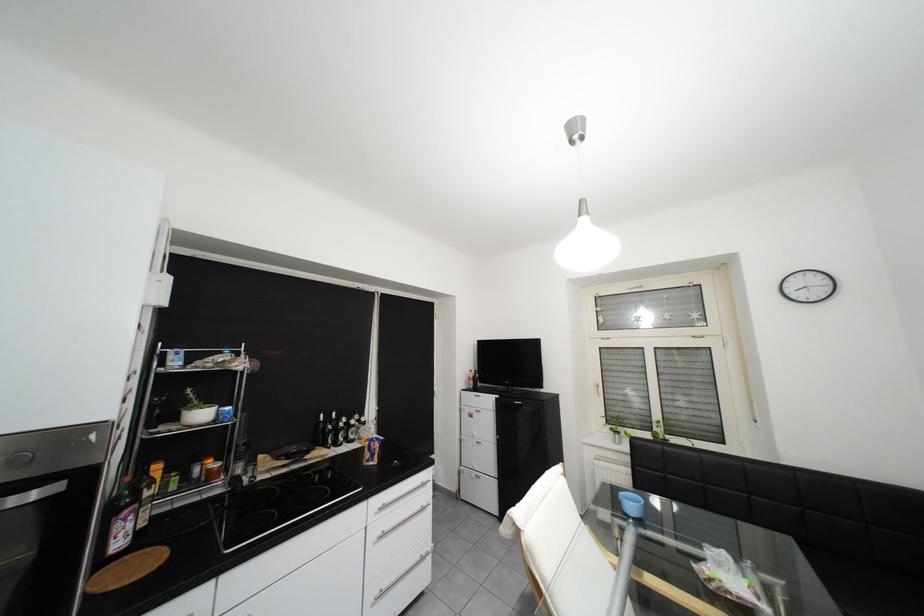
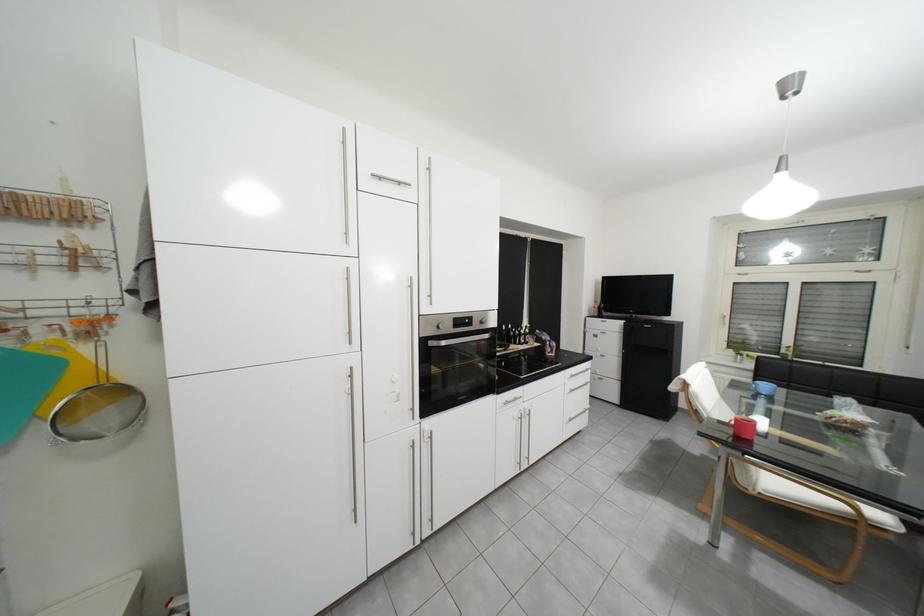
What movement of the cameraman would produce the second image?

The movement direction of the cameraman is left, backward.